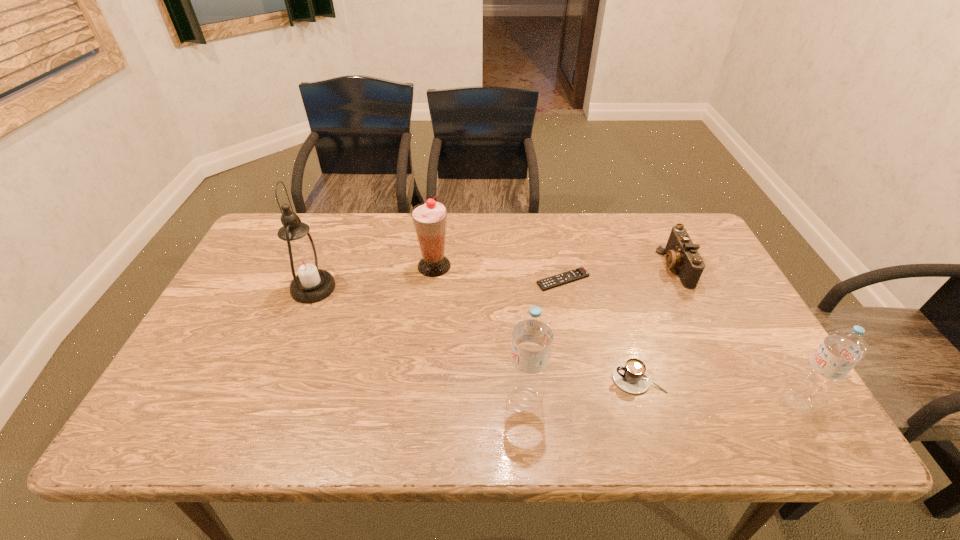
The width and height of the screenshot is (960, 540). What are the coordinates of `vacant space located on the left of the left water bottle` in the screenshot? It's located at [440, 401].

You are a GUI agent. You are given a task and a screenshot of the screen. Output one action in this format:
    pyautogui.click(x=<x>, y=<y>)
    Task: Click on the vacant position located on the left of the right water bottle
    This screenshot has width=960, height=540.
    Given the screenshot: What is the action you would take?
    pyautogui.click(x=756, y=401)

This screenshot has width=960, height=540. In order to click on vacant region located 0.080m on the back of the smoothie in this screenshot , I will do `click(437, 239)`.

In order to click on vacant space located on the front-facing side of the camera in this screenshot , I will do `click(533, 267)`.

The height and width of the screenshot is (540, 960). What are the coordinates of `vacant space situated 0.350m on the front-facing side of the camera` in the screenshot? It's located at (545, 267).

I want to click on vacant space located 0.320m on the front-facing side of the camera, so click(x=556, y=267).

I want to click on vacant space positioned on the left of the oil lamp, so click(239, 288).

You are a GUI agent. You are given a task and a screenshot of the screen. Output one action in this format:
    pyautogui.click(x=<x>, y=<y>)
    Task: Click on the vacant space located 0.160m on the back of the shortest object
    This screenshot has height=540, width=960.
    Given the screenshot: What is the action you would take?
    pyautogui.click(x=554, y=236)

In order to click on free space located 0.100m with the handle on the side of the cappuccino in this screenshot , I will do `click(570, 379)`.

This screenshot has width=960, height=540. What are the coordinates of `free spot located 0.160m with the handle on the side of the cappuccino` in the screenshot? It's located at (545, 379).